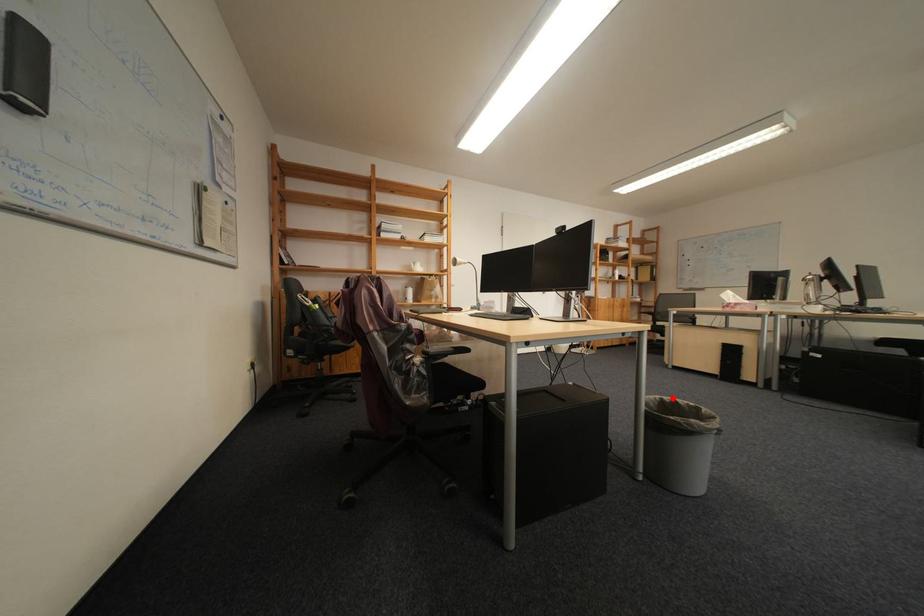
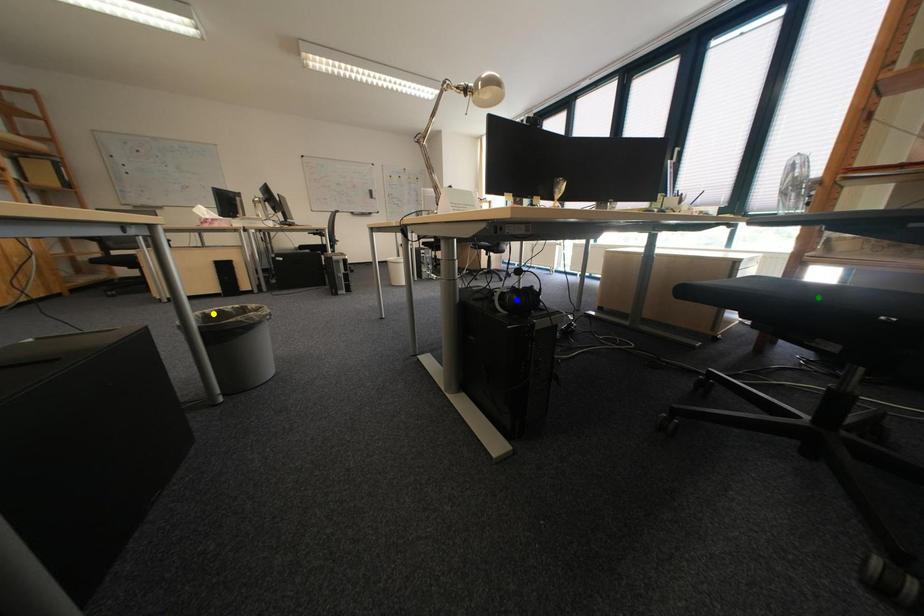
Question: I am providing you with two images of the same scene from different viewpoints. A red point is marked on the first image. You are given multiple points on the second image. Which point in image 2 is actually the same real-world point as the red point in image 1?

Choices:
 (A) blue point
 (B) green point
 (C) yellow point

Answer: (C)